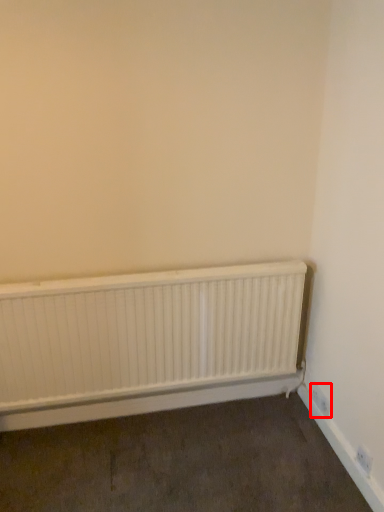
Question: Observing the image, what is the correct spatial positioning of electric outlet (annotated by the red box) in reference to radiator?

Choices:
 (A) left
 (B) right

Answer: (B)